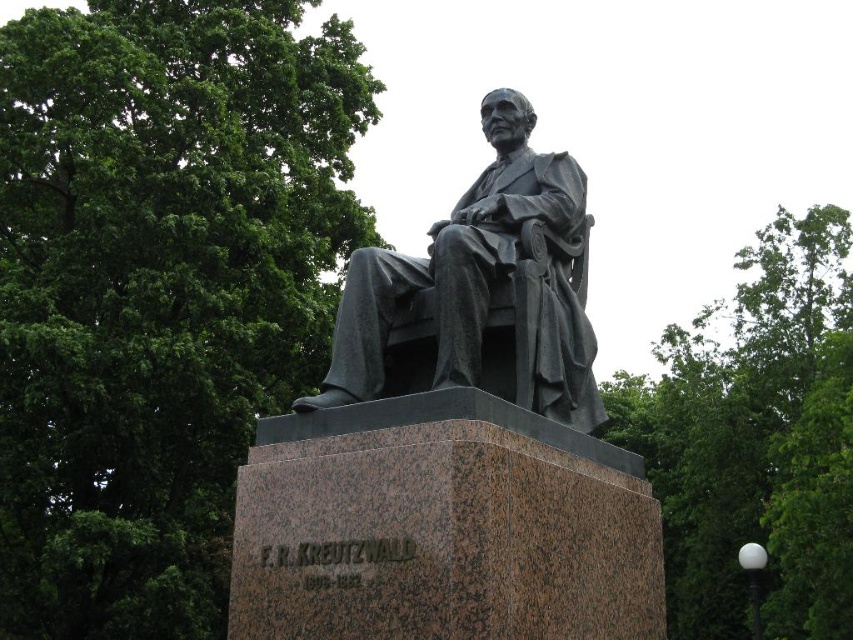
Question: Can you confirm if green leafy tree at upper right is wider than bronze statue at center?

Choices:
 (A) no
 (B) yes

Answer: (B)

Question: Which object is the farthest from the bronze statue at center?

Choices:
 (A) black polished granite statue at center
 (B) green leafy tree at upper right
 (C) green leafy tree at upper left

Answer: (B)

Question: Can you confirm if black polished granite statue at center is smaller than bronze statue at center?

Choices:
 (A) no
 (B) yes

Answer: (A)

Question: Does green leafy tree at upper left have a larger size compared to bronze statue at center?

Choices:
 (A) yes
 (B) no

Answer: (A)

Question: Which point is closer to the camera?

Choices:
 (A) black polished granite statue at center
 (B) green leafy tree at upper right
 (C) bronze statue at center

Answer: (A)

Question: Among these points, which one is nearest to the camera?

Choices:
 (A) (685, 552)
 (B) (372, 289)
 (C) (123, 385)
 (D) (598, 621)

Answer: (D)